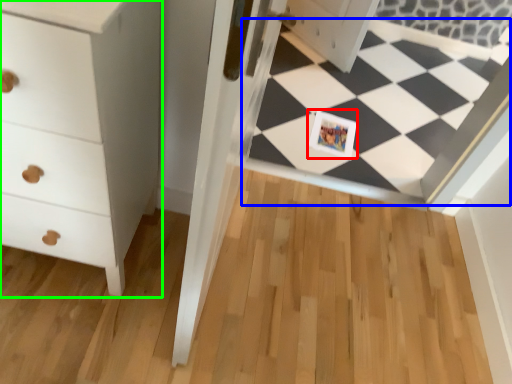
Question: Which object is the farthest from postcard (highlighted by a red box)? Choose among these: square (highlighted by a blue box) or chest of drawers (highlighted by a green box).

Choices:
 (A) square
 (B) chest of drawers

Answer: (B)